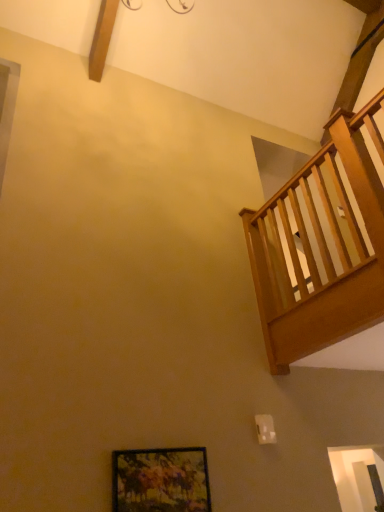
Question: Does wooden railing at upper right have a lesser height compared to wooden-framed painting at lower center?

Choices:
 (A) yes
 (B) no

Answer: (B)

Question: Are wooden railing at upper right and wooden-framed painting at lower center located far from each other?

Choices:
 (A) yes
 (B) no

Answer: (A)

Question: Does wooden railing at upper right lie in front of wooden-framed painting at lower center?

Choices:
 (A) yes
 (B) no

Answer: (A)

Question: Is wooden railing at upper right facing towards wooden-framed painting at lower center?

Choices:
 (A) yes
 (B) no

Answer: (B)

Question: Considering the relative sizes of wooden railing at upper right and wooden-framed painting at lower center in the image provided, is wooden railing at upper right smaller than wooden-framed painting at lower center?

Choices:
 (A) yes
 (B) no

Answer: (B)

Question: Can you confirm if wooden railing at upper right is bigger than wooden-framed painting at lower center?

Choices:
 (A) no
 (B) yes

Answer: (B)

Question: Considering the relative sizes of wooden-framed painting at lower center and wooden railing at upper right in the image provided, is wooden-framed painting at lower center taller than wooden railing at upper right?

Choices:
 (A) yes
 (B) no

Answer: (B)

Question: Does wooden-framed painting at lower center contain wooden railing at upper right?

Choices:
 (A) no
 (B) yes

Answer: (A)

Question: Does wooden-framed painting at lower center lie behind wooden railing at upper right?

Choices:
 (A) yes
 (B) no

Answer: (A)

Question: Is wooden-framed painting at lower center facing away from wooden railing at upper right?

Choices:
 (A) no
 (B) yes

Answer: (A)

Question: Can you confirm if wooden-framed painting at lower center is smaller than wooden railing at upper right?

Choices:
 (A) no
 (B) yes

Answer: (B)

Question: Are wooden-framed painting at lower center and wooden railing at upper right located far from each other?

Choices:
 (A) yes
 (B) no

Answer: (A)

Question: Is wooden-framed painting at lower center in front of or behind wooden railing at upper right in the image?

Choices:
 (A) behind
 (B) front

Answer: (A)